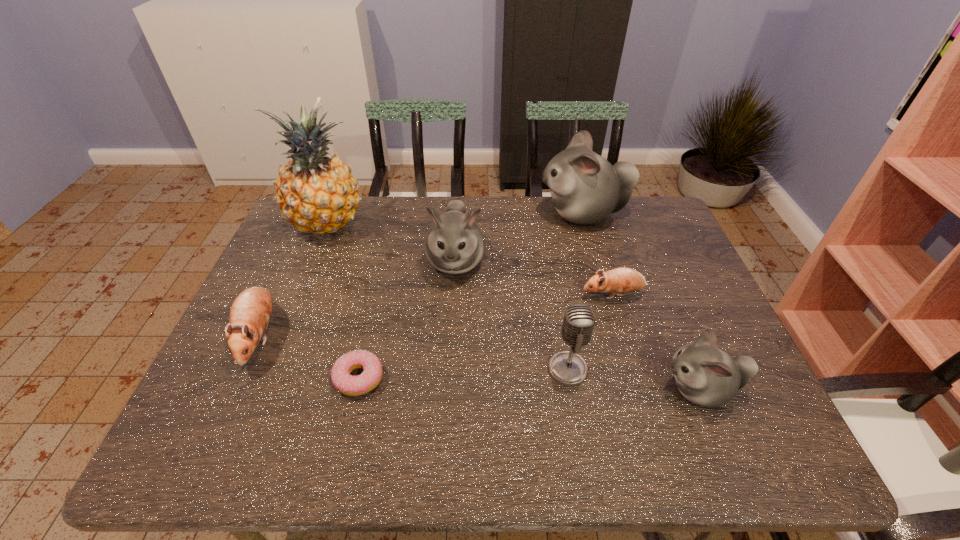
Where is `vacant space situated on the back of the microphone`? vacant space situated on the back of the microphone is located at coordinates (548, 251).

Identify the location of free space located 0.380m on the face of the third tallest hamster. The image size is (960, 540). (492, 389).

I want to click on vacant space situated on the face of the third tallest hamster, so click(554, 389).

What are the coordinates of `free region located 0.110m on the face of the third tallest hamster` in the screenshot? It's located at (612, 389).

You are a GUI agent. You are given a task and a screenshot of the screen. Output one action in this format:
    pyautogui.click(x=<x>, y=<y>)
    Task: Click on the vacant space located 0.190m at the face of the left brown hamster
    
    Given the screenshot: What is the action you would take?
    pyautogui.click(x=204, y=458)

The width and height of the screenshot is (960, 540). What are the coordinates of `vacant space located at the face of the smaller brown hamster` in the screenshot? It's located at (519, 295).

This screenshot has width=960, height=540. I want to click on vacant space located 0.160m at the face of the smaller brown hamster, so click(x=522, y=295).

At what (x,y) coordinates should I click in order to perform the action: click on vacant space located at the face of the smaller brown hamster. Please return your answer as a coordinate pair (x, y). This screenshot has height=540, width=960. Looking at the image, I should click on (453, 295).

This screenshot has height=540, width=960. Find the location of `vacant space situated 0.200m on the right of the shortest object`. vacant space situated 0.200m on the right of the shortest object is located at coordinates (470, 378).

Where is `pineapple located in the far edge section of the desktop`? Image resolution: width=960 pixels, height=540 pixels. pineapple located in the far edge section of the desktop is located at coordinates click(316, 192).